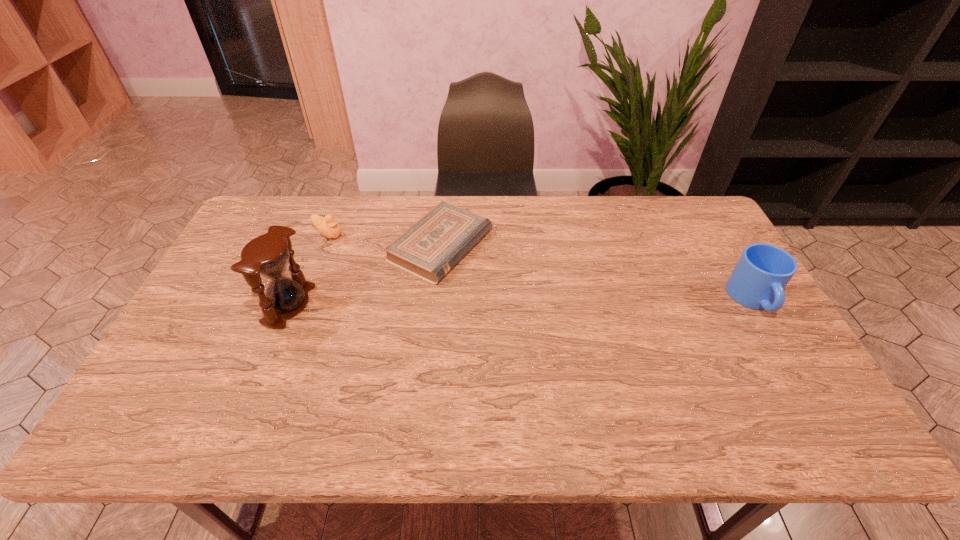
This screenshot has height=540, width=960. In order to click on hourglass in this screenshot , I will do `click(268, 255)`.

At what (x,y) coordinates should I click in order to perform the action: click on the rightmost object. Please return your answer as a coordinate pair (x, y). The width and height of the screenshot is (960, 540). Looking at the image, I should click on (761, 274).

What are the coordinates of `mug` in the screenshot? It's located at (761, 274).

Where is `the second object from right to left`? This screenshot has height=540, width=960. the second object from right to left is located at coordinates (429, 249).

Locate an element on the screen. This screenshot has width=960, height=540. the shortest object is located at coordinates pyautogui.click(x=429, y=249).

You are a GUI agent. You are given a task and a screenshot of the screen. Output one action in this format:
    pyautogui.click(x=<x>, y=<y>)
    Task: Click on the duckling
    
    Given the screenshot: What is the action you would take?
    pyautogui.click(x=327, y=226)

Identify the location of free spot located 0.360m on the right of the hourglass. This screenshot has width=960, height=540. (439, 305).

The image size is (960, 540). I want to click on free space located 0.050m on the side of the rightmost object with the handle, so click(777, 339).

Where is `vacant area located on the spine side of the second object from right to left`? Image resolution: width=960 pixels, height=540 pixels. vacant area located on the spine side of the second object from right to left is located at coordinates tap(563, 301).

Find the location of a particular element. This screenshot has width=960, height=540. vacant position located on the spine side of the second object from right to left is located at coordinates (565, 302).